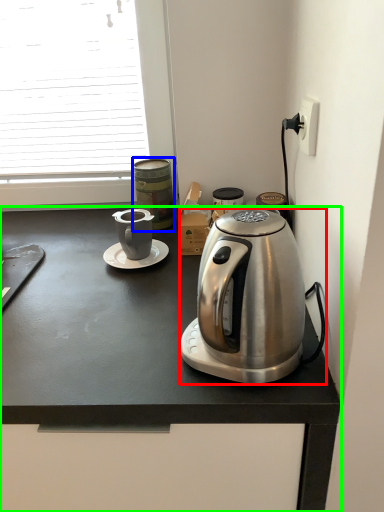
Question: Based on their relative distances, which object is nearer to coffee maker (highlighted by a red box)? Choose from appliance (highlighted by a blue box) and desk (highlighted by a green box).

Choices:
 (A) appliance
 (B) desk

Answer: (B)